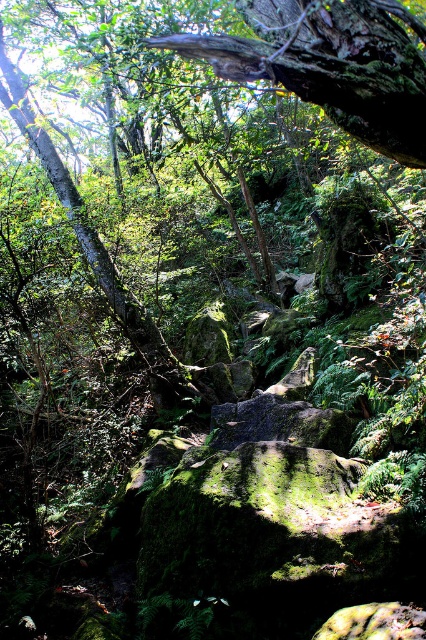
You are standing in the forest and want to take a photo of the green mossy tree trunk at upper center. If your camera can focus on objects up to 3 meters away, will you be able to capture a clear image?

The green mossy tree trunk at upper center and camera are 2.62 meters apart, so yes, the camera can focus on the green mossy tree trunk at upper center since it is within the 3 meters range.

You are a hiker who wants to take a photo of both the green mossy tree trunk at upper center and the green mossy tree trunk at upper left. Since you want both in the frame, which tree trunk should you position yourself closer to and why?

You should position yourself closer to the green mossy tree trunk at upper left because it is shorter than the green mossy tree trunk at upper center, allowing both to be in the frame when you adjust your distance accordingly.

Looking at this image, you are a hiker carrying a 2.5 meter long pole. You want to place the pole between two points in the forest. The points are labeled as point (256, 65). Can the pole fit between them without bending?

The distance between the two points labeled as point (256, 65) is 3.11 meters. Since the pole is 2.5 meters long, it can fit between them without bending as the distance is greater than the pole length.